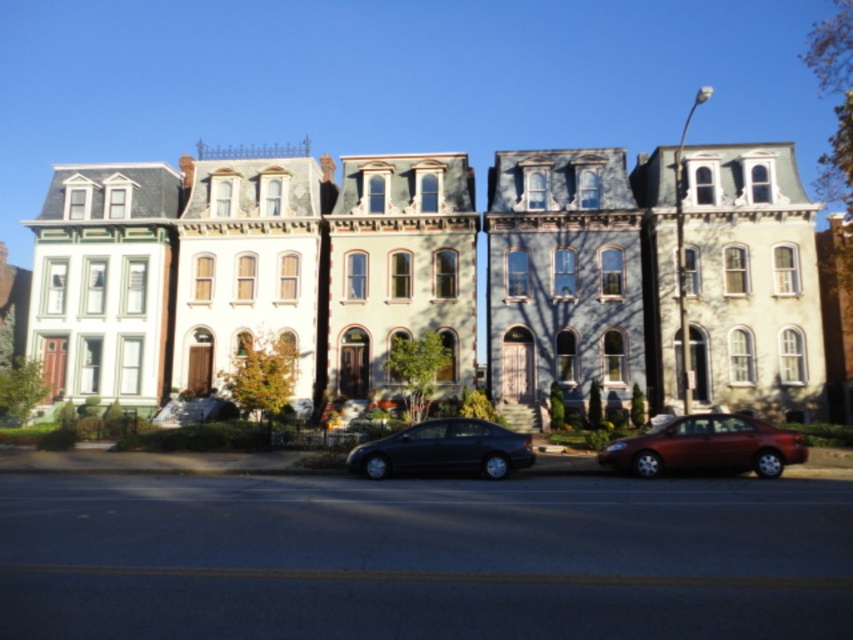
Is point (672, 444) in front of point (396, 451)?

Yes, point (672, 444) is closer to viewer.

Between point (779, 465) and point (482, 436), which one is positioned in front?

Point (779, 465) is in front.

The width and height of the screenshot is (853, 640). What are the coordinates of `shiny red sedan at lower right` in the screenshot? It's located at (706, 445).